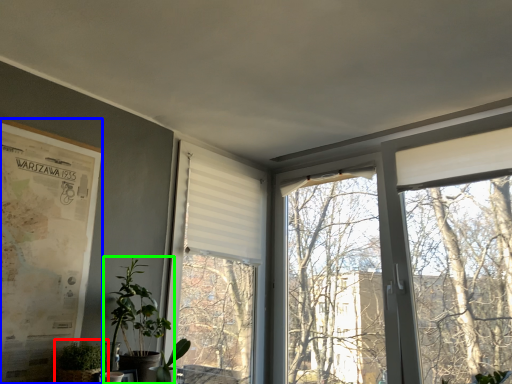
Question: Which object is positioned farthest from houseplant (highlighted by a red box)? Select from poster page (highlighted by a blue box) and houseplant (highlighted by a green box).

Choices:
 (A) poster page
 (B) houseplant

Answer: (A)